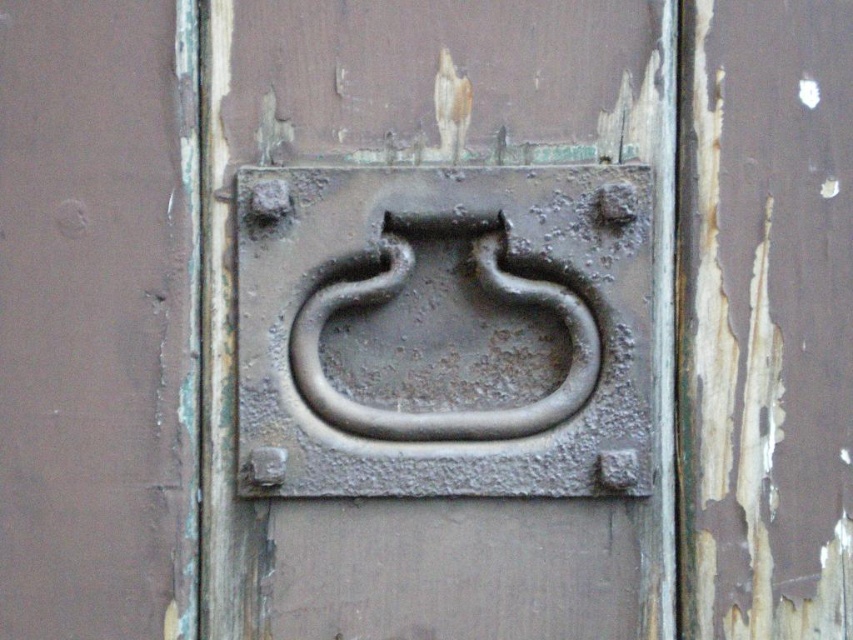
You are a locksmith examining a door with a rusty metal handle at center and a rusty metal door handle at center. Which object is taller?

The rusty metal handle at center is much taller than the rusty metal door handle at center.

You are standing in front of the wooden door with a metal door handle. The door handle is at the center. There is a point labeled as point (440, 323). Is this point located on the rusty metal handle at center?

Yes, the point (440, 323) corresponds to the rusty metal handle at center according to the description.

You are trying to open the door shown in the image. You see the rusty metal handle at center and the rusty metal door handle at center. Which one should you grab to open the door?

Result: You should grab the rusty metal door handle at center because the rusty metal handle at center is positioned over it, indicating it is the actual handle used to open the door.